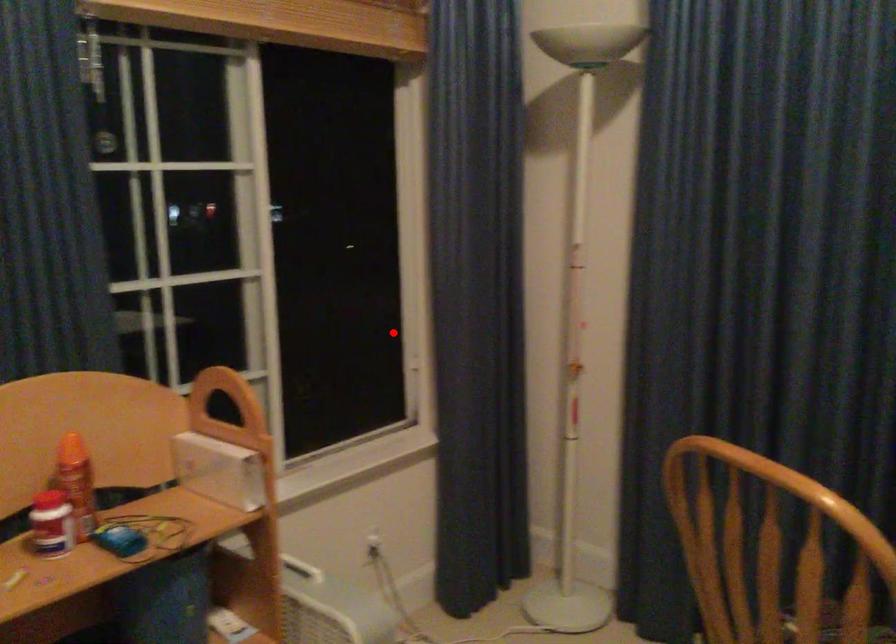
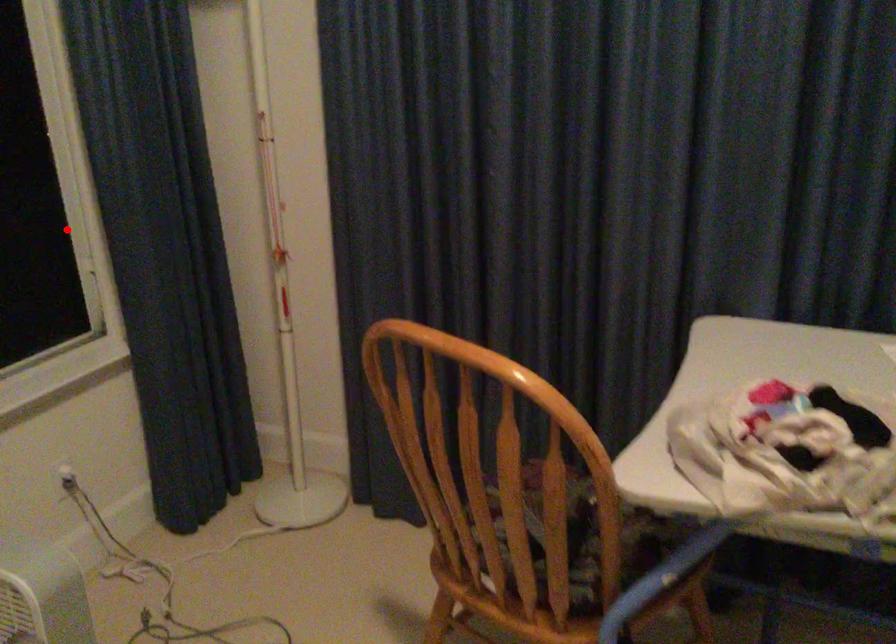
I am providing you with two images of the same scene from different viewpoints. A red point is marked on the first image and another point is marked on the second image. Is the marked point in image1 the same physical position as the marked point in image2?

Yes